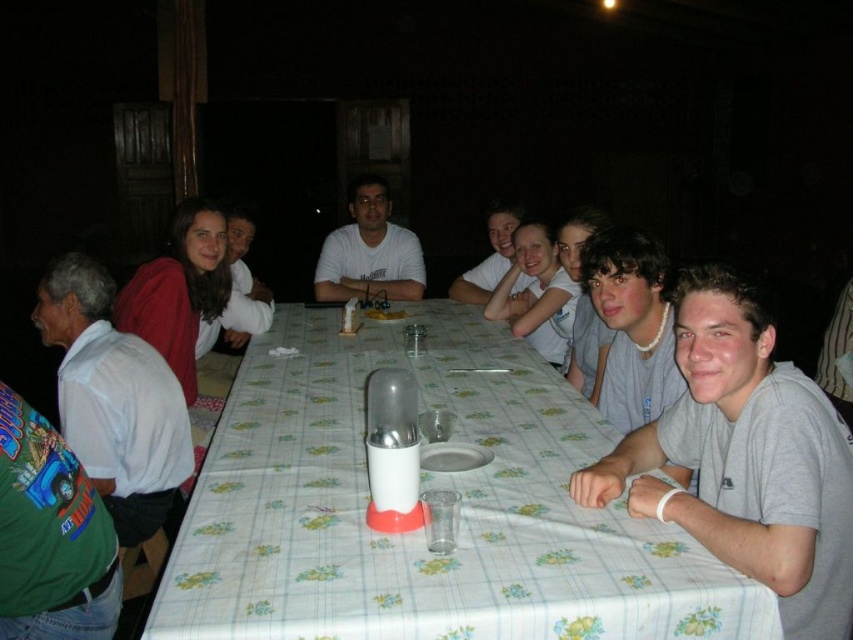
You are standing at the entrance of the room and notice a white matte shirt at left. Can you determine its exact position based on the coordinate system provided?

The white matte shirt at left is located at point (113,397).

You are a photographer trying to capture a candid shot of the group. You notice two people wearing white matte shirts at the table. Which person is sitting closer to the camera, the one wearing the white matte shirt at left or the one in the matte white shirt at upper center?

The white matte shirt at left is taller than the matte white shirt at upper center, which means the person wearing the white matte shirt at left is closer to the camera.